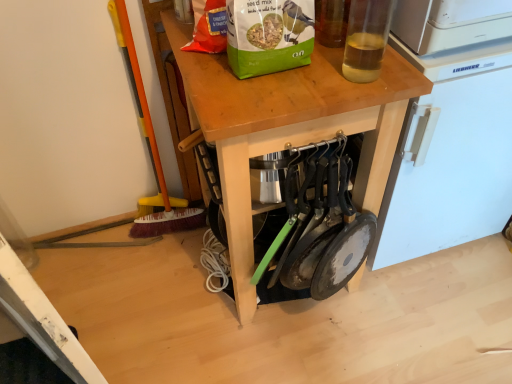
The height and width of the screenshot is (384, 512). I want to click on vacant area that is in front of white plastic refrigerator at upper right, so click(x=425, y=322).